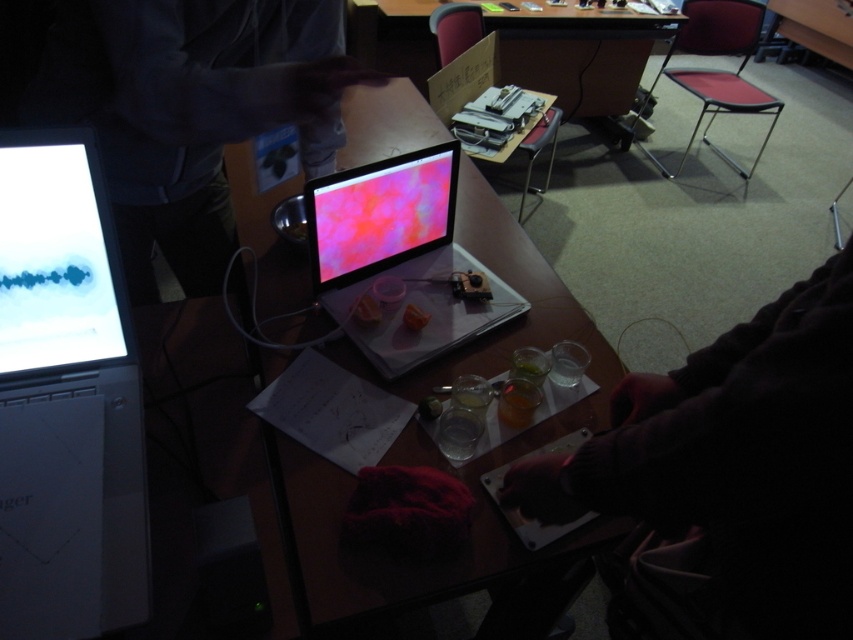
Question: Among these points, which one is farthest from the camera?

Choices:
 (A) (711, 525)
 (B) (352, 346)
 (C) (508, 36)
 (D) (57, 193)

Answer: (C)

Question: Which point is closer to the camera taking this photo?

Choices:
 (A) (428, 225)
 (B) (784, 321)
 (C) (35, 291)
 (D) (547, 272)

Answer: (B)

Question: Which object appears closest to the camera in this image?

Choices:
 (A) matte plastic monitor at center
 (B) shiny plastic laptop at center
 (C) wooden desk at center
 (D) white glossy laptop at left

Answer: (D)

Question: From the image, what is the correct spatial relationship of dark wool sweater at lower right in relation to white glossy laptop at left?

Choices:
 (A) right
 (B) left

Answer: (A)

Question: Is white glossy laptop at left thinner than matte plastic laptop at center?

Choices:
 (A) yes
 (B) no

Answer: (A)

Question: Can you confirm if dark wool sweater at lower right is wider than white glossy laptop at left?

Choices:
 (A) no
 (B) yes

Answer: (B)